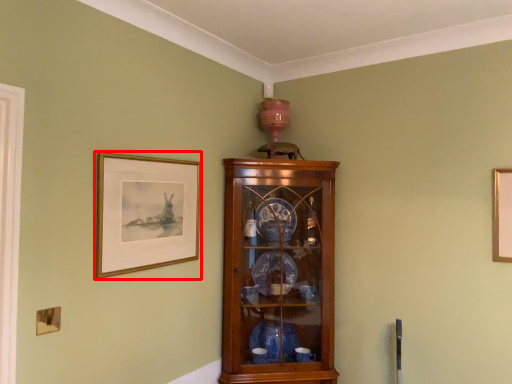
Question: From the image's perspective, where is picture frame (annotated by the red box) located in relation to cupboard in the image?

Choices:
 (A) above
 (B) below

Answer: (A)